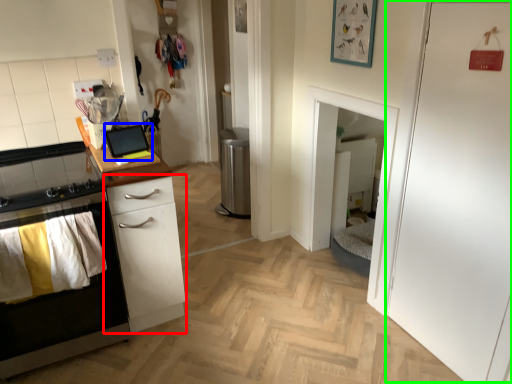
Question: Based on their relative distances, which object is farther from chest of drawers (highlighted by a red box)? Choose from appliance (highlighted by a blue box) and door (highlighted by a green box).

Choices:
 (A) appliance
 (B) door

Answer: (B)